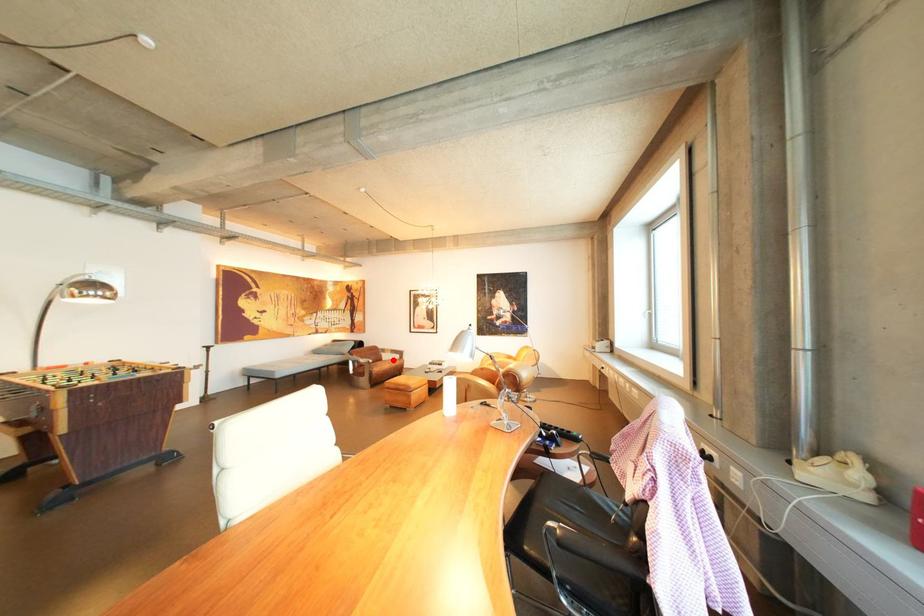
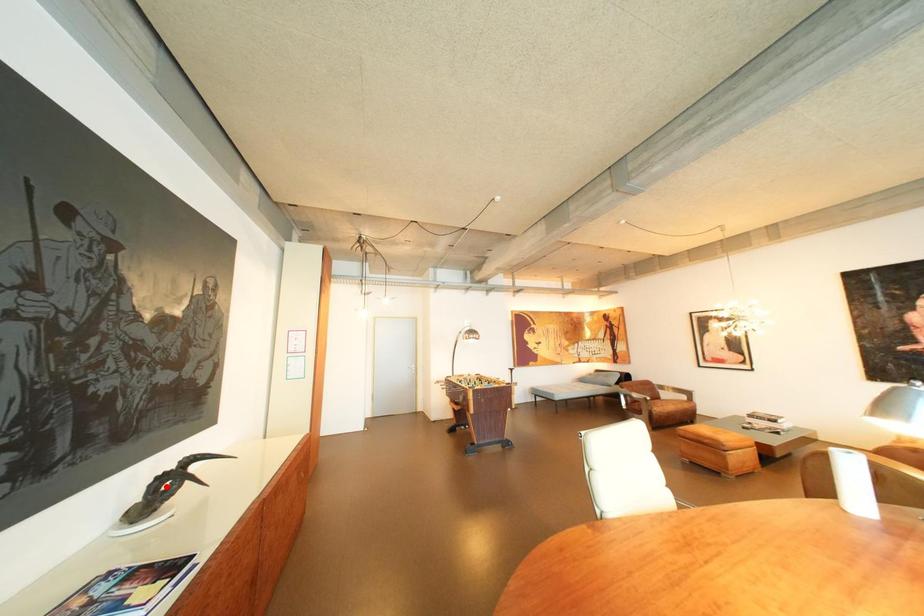
I am providing you with two images of the same scene from different viewpoints. A red point is marked on the first image and another point is marked on the second image. Are the points marked in image1 and image2 representing the same 3D position?

No